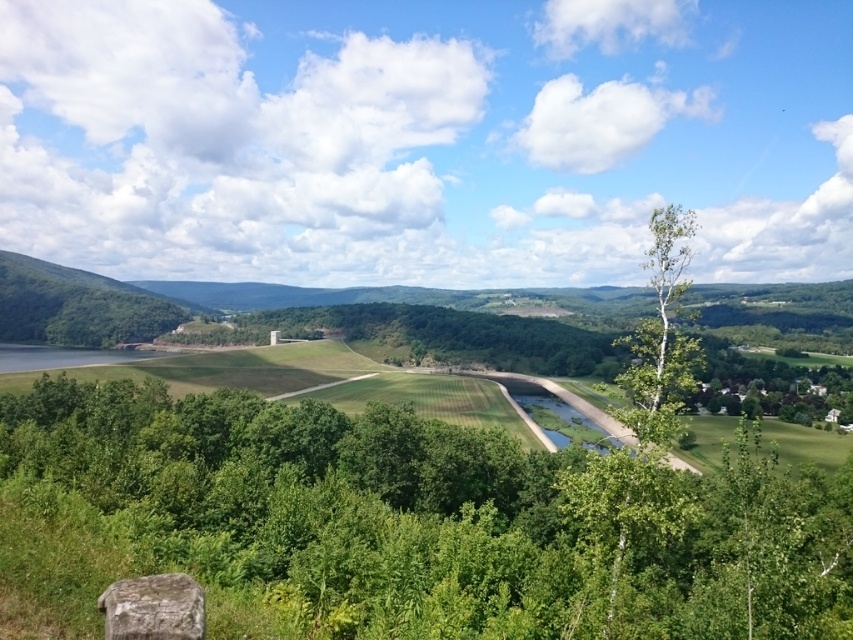
Question: Is green leafy tree at left positioned behind rusty metallic rock at lower left?

Choices:
 (A) yes
 (B) no

Answer: (A)

Question: Can you confirm if white smooth tree at right is bigger than rusty metallic rock at lower left?

Choices:
 (A) yes
 (B) no

Answer: (A)

Question: Among these objects, which one is farthest from the camera?

Choices:
 (A) green leafy tree at center
 (B) green leafy tree at left

Answer: (B)

Question: Which point is closer to the camera?

Choices:
 (A) green leafy tree at left
 (B) green leafy tree at center

Answer: (B)

Question: Estimate the real-world distances between objects in this image. Which object is closer to the green leafy tree at left?

Choices:
 (A) rusty metallic rock at lower left
 (B) white smooth tree at right
 (C) green leafy tree at center

Answer: (C)

Question: Is green leafy tree at center closer to camera compared to green leafy tree at left?

Choices:
 (A) no
 (B) yes

Answer: (B)